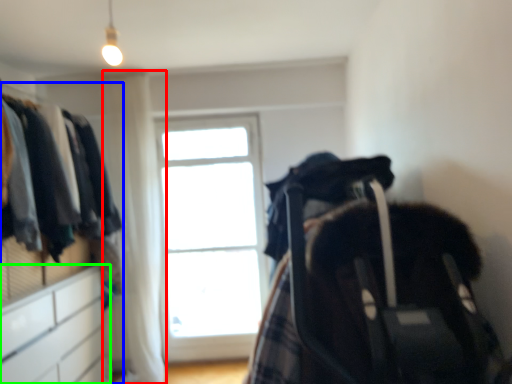
Question: Based on their relative distances, which object is nearer to curtain (highlighted by a red box)? Choose from dresser (highlighted by a blue box) and file cabinet (highlighted by a green box).

Choices:
 (A) dresser
 (B) file cabinet

Answer: (A)